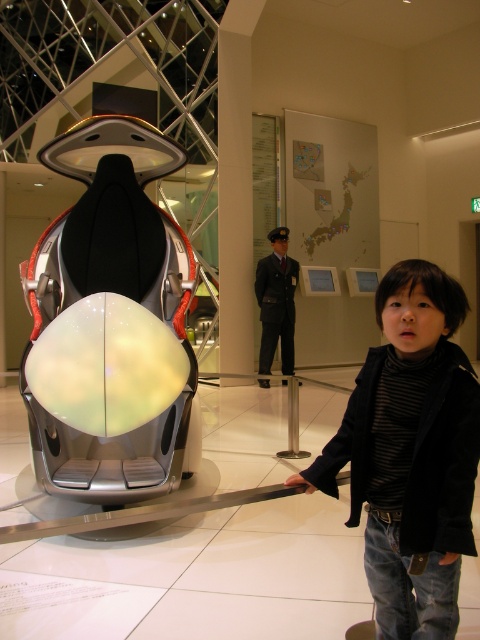
You are a visitor at the museum and want to sit on the glossy metallic seat at center. However, there is a black turtleneck sweater at right in the way. Can you sit down without moving the sweater?

The glossy metallic seat at center is above the black turtleneck sweater at right, so you can sit down without moving the sweater since the seat is elevated.

You are a visitor at the museum and want to take a photo of the glossy metallic seat at center without any obstructions. Is the black turtleneck sweater at right blocking your view?

The black turtleneck sweater at right is behind the glossy metallic seat at center, so it won not block your view when taking a photo.